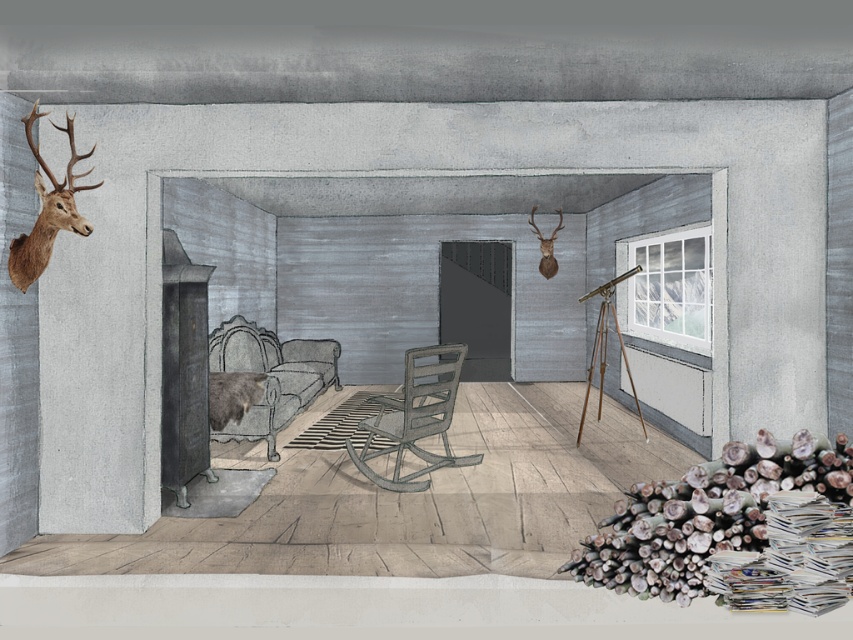
In the scene shown: You are planning to place a new painting on the wall between the metallic gray rocking chair at center and the brown matte deer head at upper center. Which object should the painting be closer to if you want it to balance the visual weight of the two objects?

The metallic gray rocking chair at center is larger in size than the brown matte deer head at upper center, so the painting should be closer to the brown matte deer head at upper center to balance their visual weights.

You are a parent holding a child who is scared of the fuzzy brown bear at center. The child wants to know how far they are from the bear. What do you tell them?

The fuzzy brown bear at center is 5.66 meters away from you, so you are quite a safe distance away from the bear.

You are standing in the room and want to touch the fuzzy brown bear at center and the brown matte deer head at upper center. Which object can you reach first without moving your position?

The fuzzy brown bear at center is closer to the viewer than the brown matte deer head at upper center, so you can reach the fuzzy brown bear at center first without moving your position.